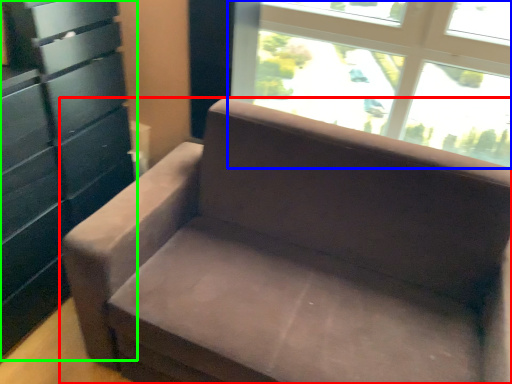
Question: Considering the real-world distances, which object is farthest from studio couch (highlighted by a red box)? window (highlighted by a blue box) or dresser (highlighted by a green box)?

Choices:
 (A) window
 (B) dresser

Answer: (A)